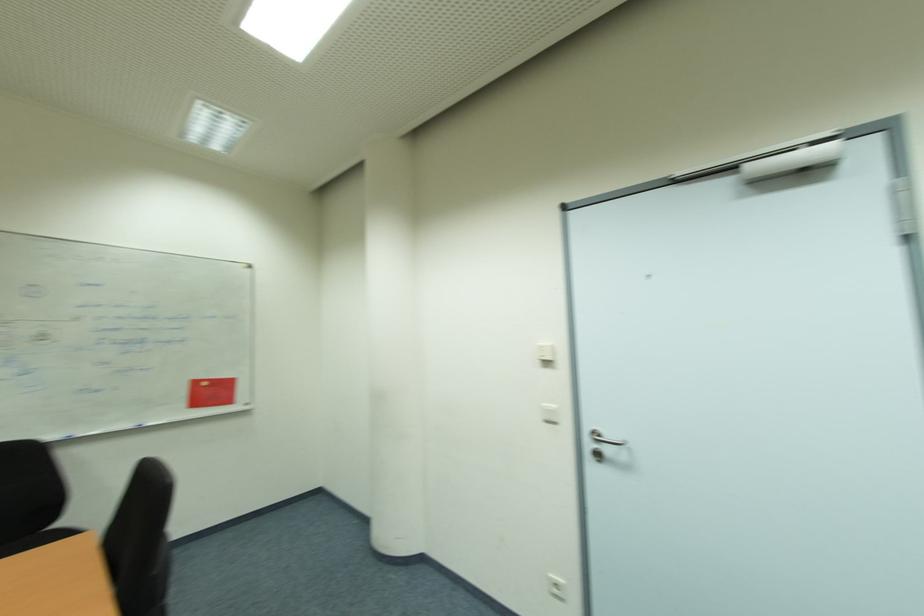
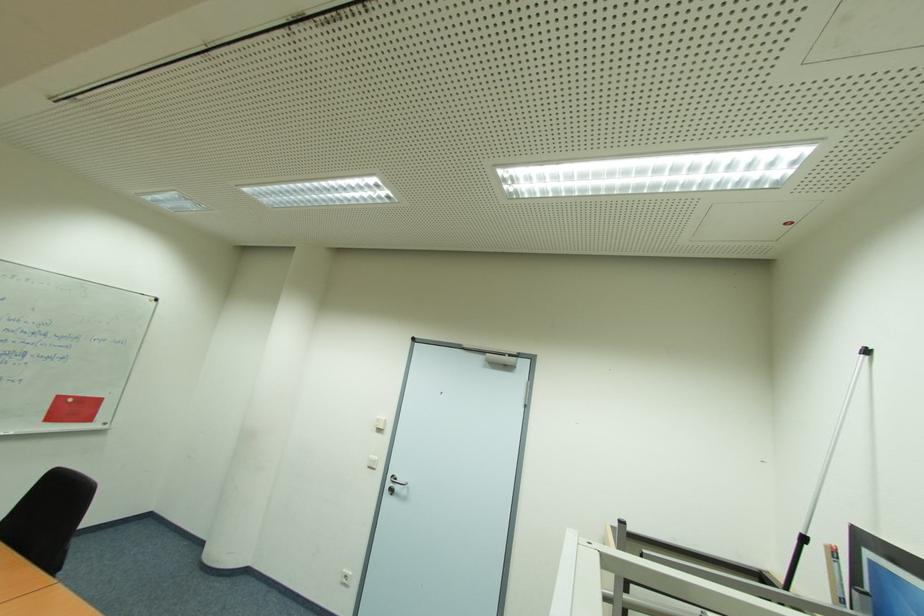
Question: Which direction would the cameraman need to move to produce the second image? Reply with the corresponding letter.

Choices:
 (A) Left
 (B) Right
 (C) Forward
 (D) Backward

Answer: (D)